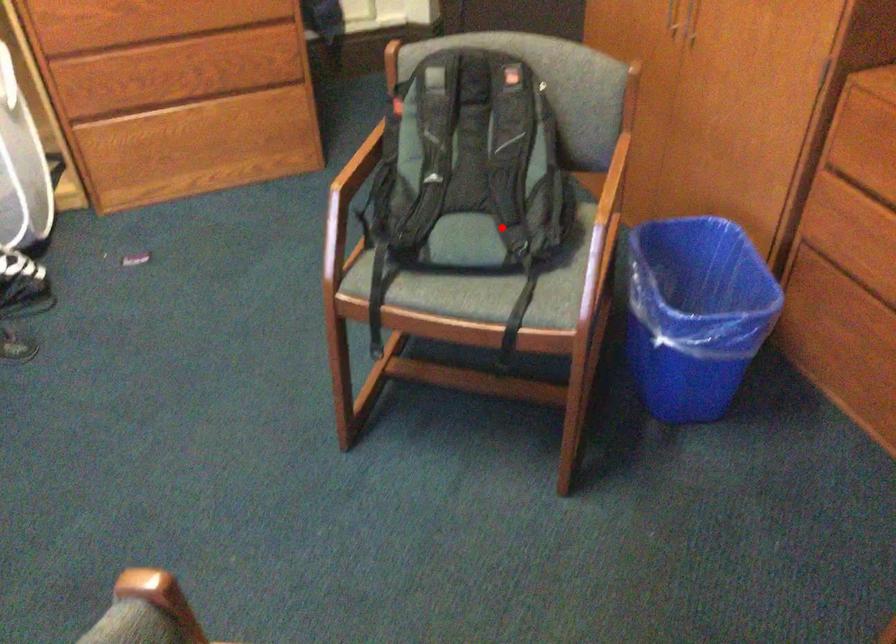
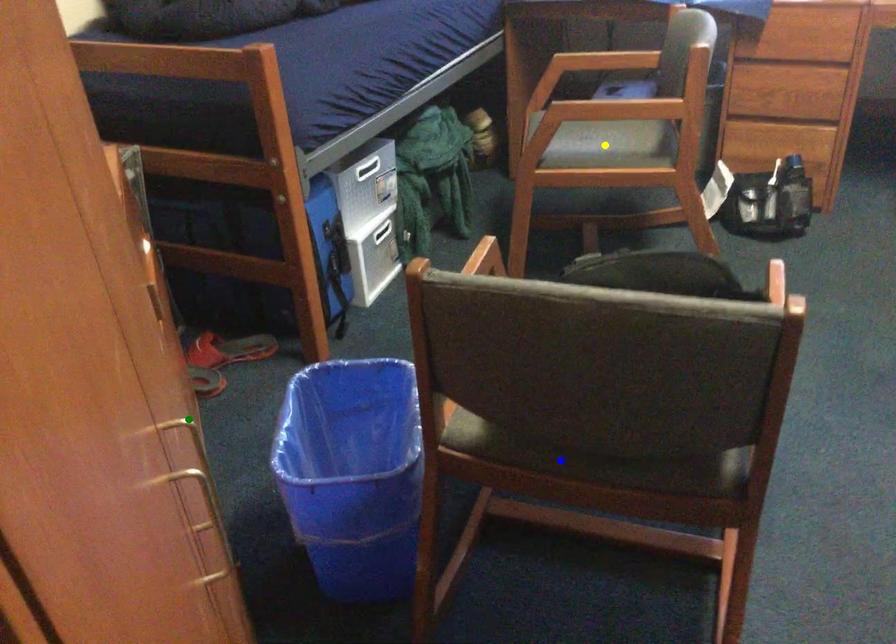
Question: I am providing you with two images of the same scene from different viewpoints. A red point is marked on the first image. You are given multiple points on the second image. Which spot in image 2 lines up with the point in image 1?

Choices:
 (A) blue point
 (B) yellow point
 (C) green point

Answer: (A)